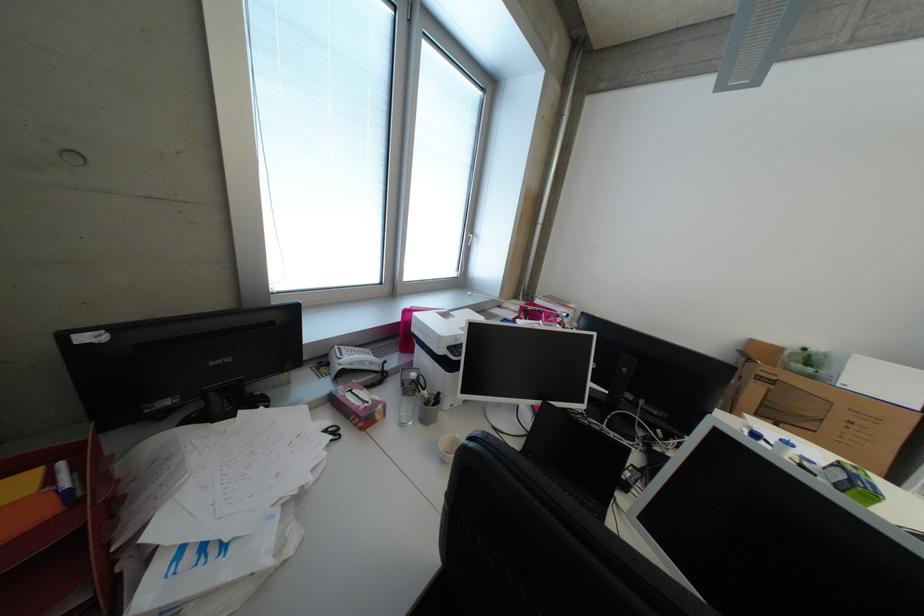
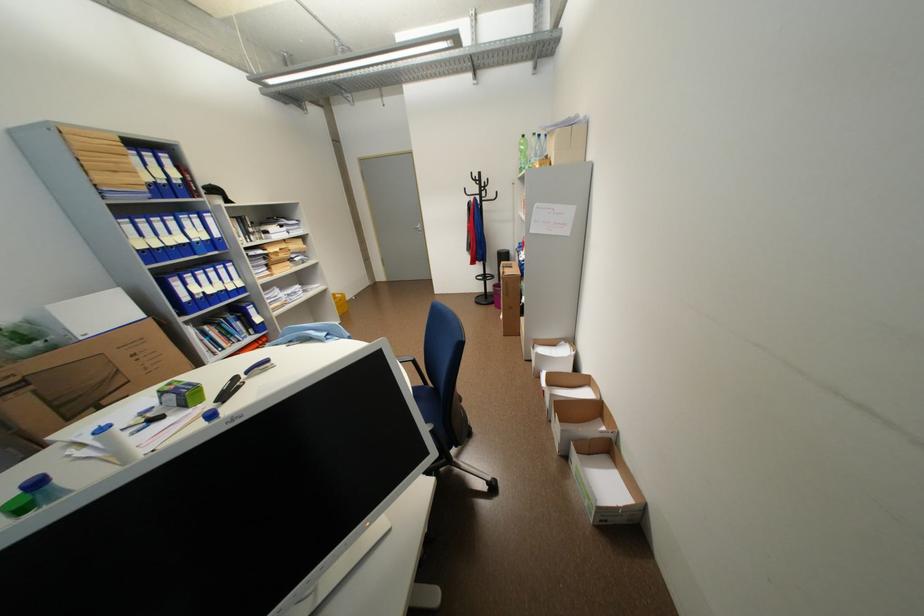
The point at (795, 444) is marked in the first image. Where is the corresponding point in the second image?

(111, 431)